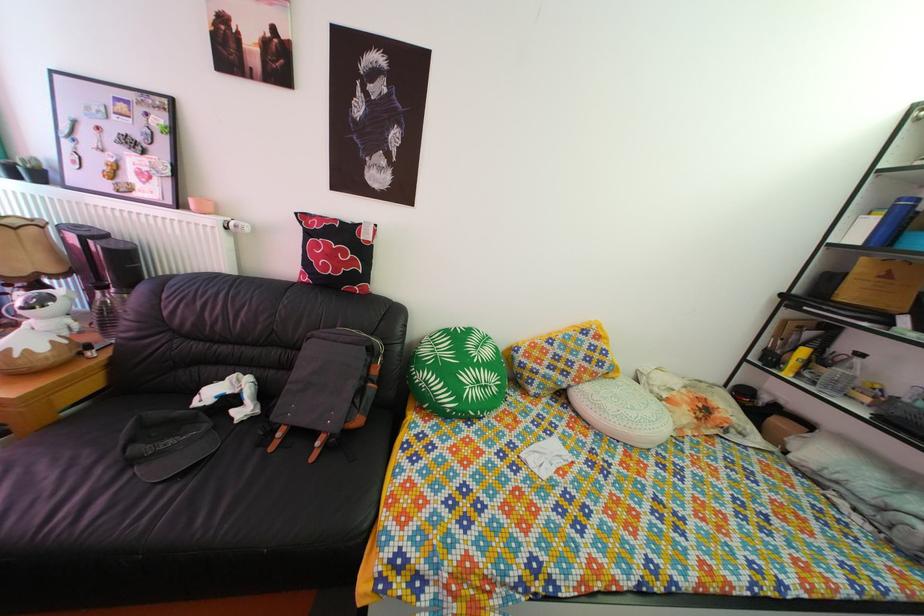
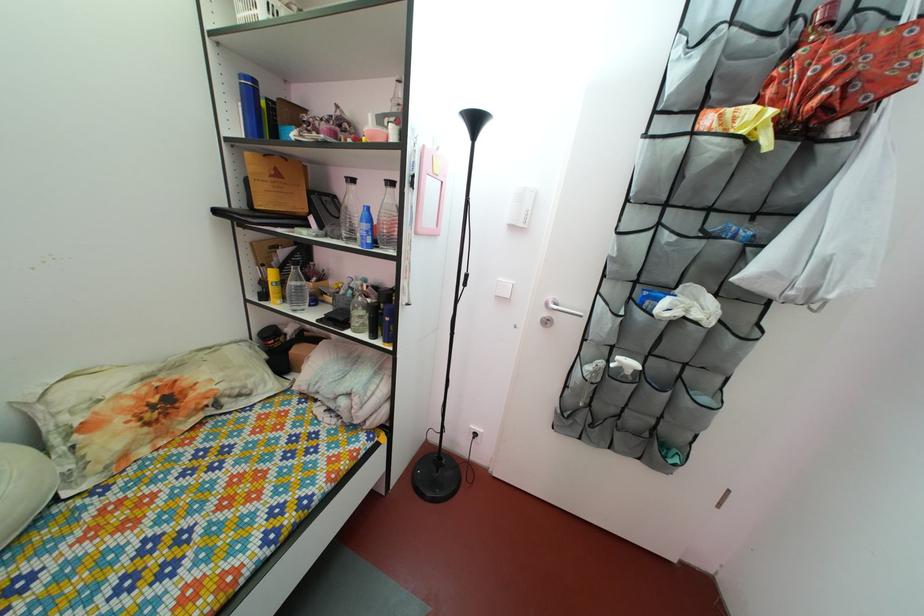
In the second image, find the point that corresponds to the point at 818,342 in the first image.

(292, 262)